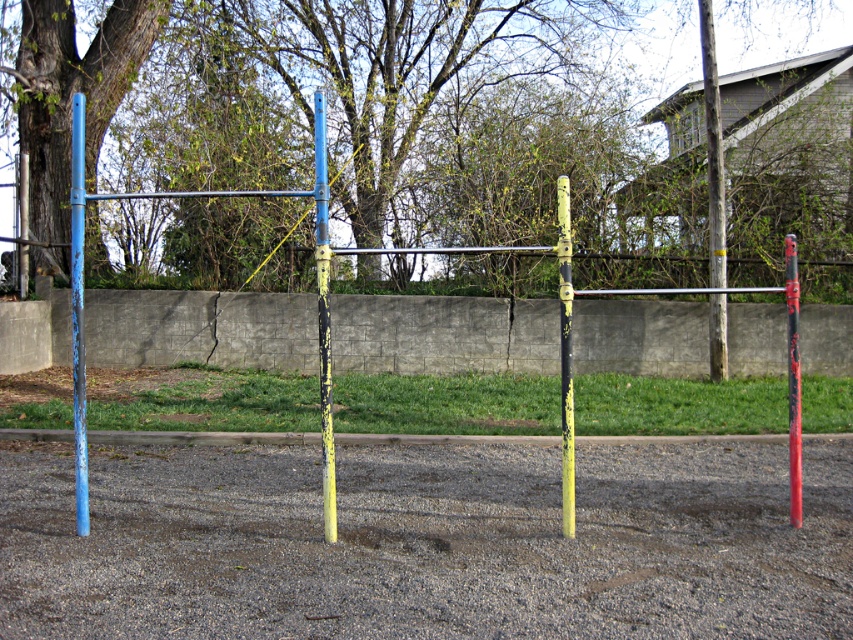
Does concrete wall at center appear on the right side of red glossy pole at center?

No, concrete wall at center is not to the right of red glossy pole at center.

Is the position of concrete wall at center less distant than that of red glossy pole at center?

No, concrete wall at center is further to the viewer.

Does point (836, 333) lie behind point (785, 284)?

No, it is not.

I want to click on concrete wall at center, so (x=444, y=333).

Is brown rough tree at upper left thinner than red glossy pole at center?

Incorrect, brown rough tree at upper left's width is not less than red glossy pole at center's.

Who is more forward, (242, 145) or (796, 353)?

Positioned in front is point (796, 353).

Who is more forward, (229,211) or (793,353)?

Point (793,353)

Identify the location of brown rough tree at upper left. The height and width of the screenshot is (640, 853). (381, 120).

Can you confirm if concrete wall at center is taller than brushed metal pole at upper left?

No, concrete wall at center is not taller than brushed metal pole at upper left.

Who is shorter, concrete wall at center or brushed metal pole at upper left?

With less height is concrete wall at center.

Describe the element at coordinates (444, 333) in the screenshot. This screenshot has width=853, height=640. I see `concrete wall at center` at that location.

Identify the location of concrete wall at center. (444, 333).